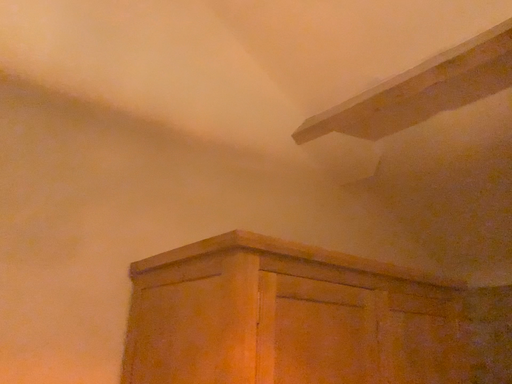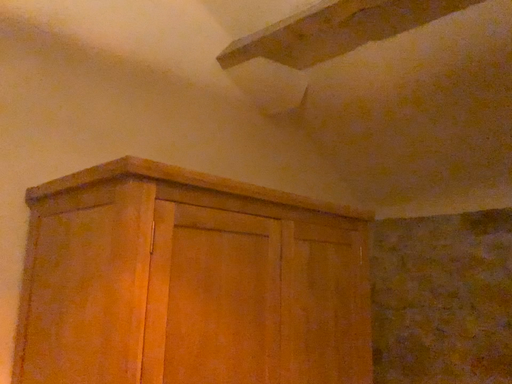
Question: How did the camera likely rotate when shooting the video?

Choices:
 (A) rotated left
 (B) rotated right

Answer: (B)